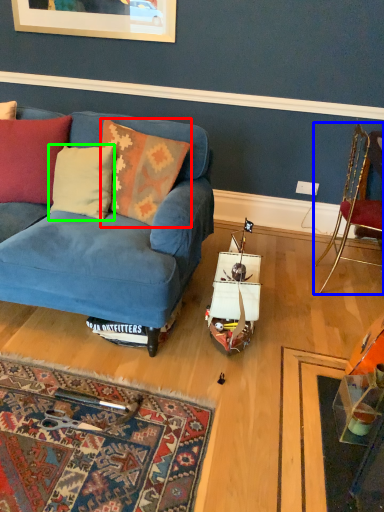
Question: Which object is positioned closest to pillow (highlighted by a red box)? Select from chair (highlighted by a blue box) and pillow (highlighted by a green box).

Choices:
 (A) chair
 (B) pillow

Answer: (B)